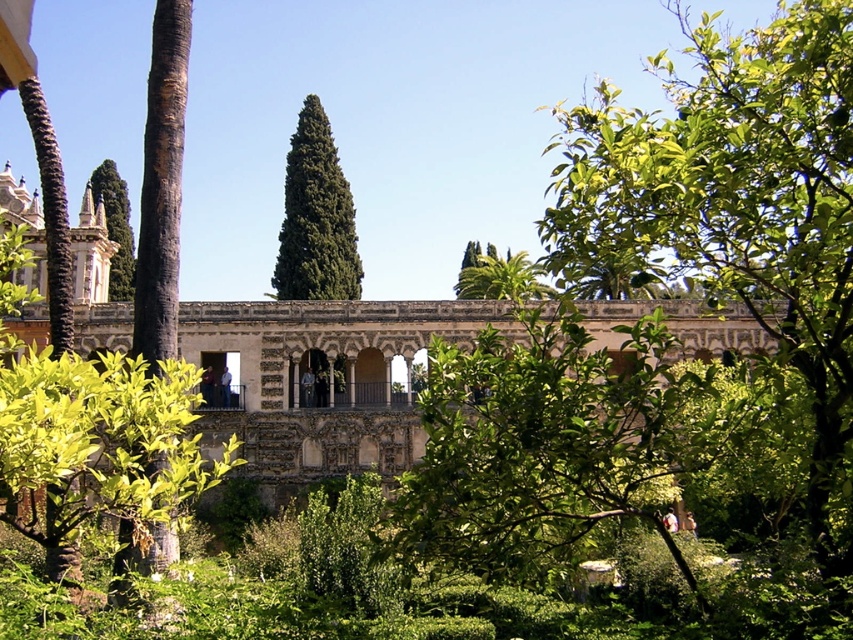
Question: Which object appears farthest from the camera in this image?

Choices:
 (A) stone arches at center
 (B) green leafy tree at left
 (C) green leafy tree at center
 (D) green textured tree at center

Answer: (B)

Question: In this image, where is green leafy tree at center located relative to stone arches at center?

Choices:
 (A) below
 (B) above

Answer: (B)

Question: Is the position of stone arches at center less distant than that of green textured tree at center?

Choices:
 (A) no
 (B) yes

Answer: (B)

Question: Can you confirm if green leafy tree at center is thinner than green textured tree at center?

Choices:
 (A) no
 (B) yes

Answer: (A)

Question: Based on their relative distances, which object is farther from the stone arches at center?

Choices:
 (A) green leafy tree at center
 (B) green textured tree at center
 (C) green leafy tree at left

Answer: (A)

Question: Which of the following is the closest to the observer?

Choices:
 (A) (335, 332)
 (B) (126, 284)
 (C) (808, 353)

Answer: (C)